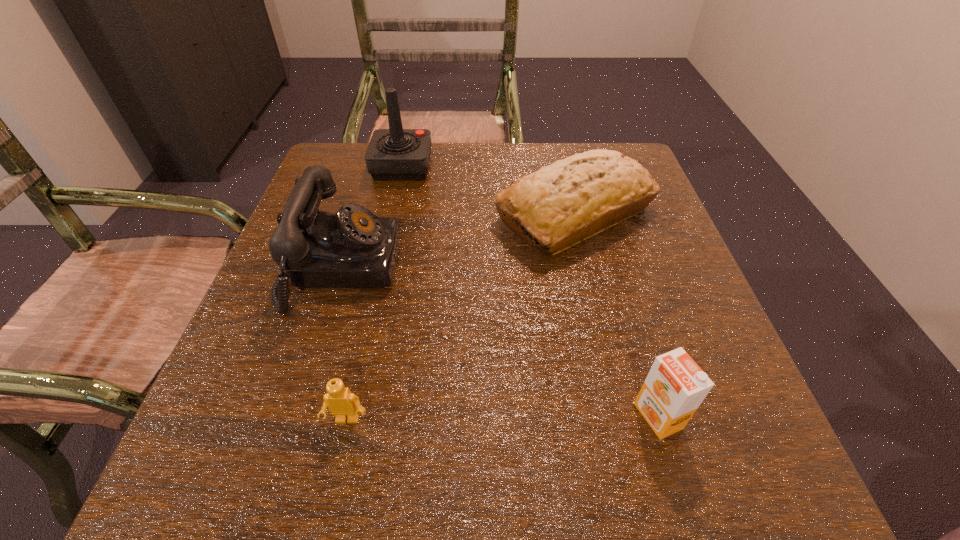
At what (x,y) coordinates should I click in order to perform the action: click on free space at the near edge of the desktop. Please return your answer as a coordinate pair (x, y). The image size is (960, 540). Looking at the image, I should click on (507, 477).

In the image, there is a desktop. In order to click on vacant space at the left edge in this screenshot , I will do `click(327, 206)`.

Where is `free space at the right edge of the desktop`? free space at the right edge of the desktop is located at coordinates [654, 294].

You are a GUI agent. You are given a task and a screenshot of the screen. Output one action in this format:
    pyautogui.click(x=<x>, y=<y>)
    Task: Click on the free region at the far left corner
    The width and height of the screenshot is (960, 540).
    Given the screenshot: What is the action you would take?
    pyautogui.click(x=344, y=188)

Locate an element on the screen. This screenshot has height=540, width=960. vacant position at the near left corner of the desktop is located at coordinates (204, 465).

The image size is (960, 540). I want to click on free space at the near right corner of the desktop, so click(x=684, y=502).

You are a GUI agent. You are given a task and a screenshot of the screen. Output one action in this format:
    pyautogui.click(x=<x>, y=<y>)
    Task: Click on the empty space between the joystick and the orange juice
    This screenshot has width=960, height=540.
    Given the screenshot: What is the action you would take?
    pyautogui.click(x=530, y=291)

Where is `unoccupied position between the joystick and the bread`? The height and width of the screenshot is (540, 960). unoccupied position between the joystick and the bread is located at coordinates (489, 190).

You are a GUI agent. You are given a task and a screenshot of the screen. Output one action in this format:
    pyautogui.click(x=<x>, y=<y>)
    Task: Click on the empty space between the orange juice and the bread
    Image resolution: width=960 pixels, height=540 pixels.
    Given the screenshot: What is the action you would take?
    pyautogui.click(x=616, y=314)

Find the location of `empty space between the bread and the telephone`. empty space between the bread and the telephone is located at coordinates (458, 240).